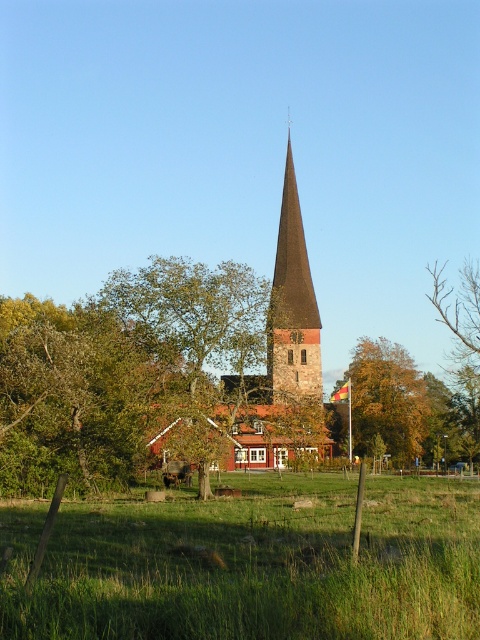
Question: Observing the image, what is the correct spatial positioning of green leafy tree at center in reference to yellow autumn leaves at center?

Choices:
 (A) right
 (B) left

Answer: (B)

Question: Can you confirm if green leafy tree at center is smaller than dark brown stone spire at center?

Choices:
 (A) yes
 (B) no

Answer: (A)

Question: Is green grass at center smaller than brown stone church at center?

Choices:
 (A) yes
 (B) no

Answer: (A)

Question: Based on their relative distances, which object is nearer to the green leafy tree at left?

Choices:
 (A) yellow autumn leaves at center
 (B) green grass at center
 (C) green leafy tree at center

Answer: (C)

Question: Which object appears closest to the camera in this image?

Choices:
 (A) dark brown stone spire at center
 (B) green grass at center
 (C) green leafy tree at left
 (D) brown stone church at center

Answer: (B)

Question: Considering the real-world distances, which object is farthest from the dark brown stone spire at center?

Choices:
 (A) yellow autumn leaves at center
 (B) brown stone church at center
 (C) green leafy tree at left
 (D) green leafy tree at center

Answer: (C)